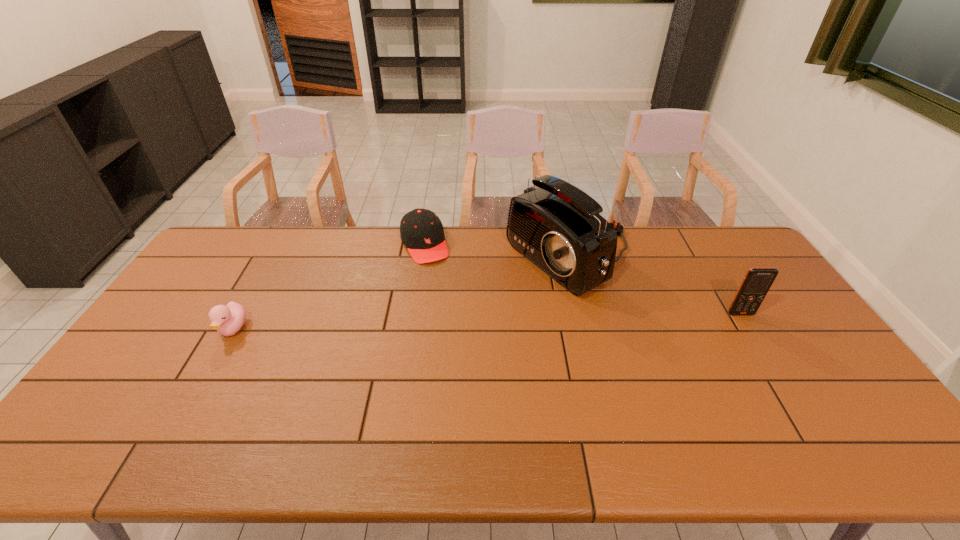
The width and height of the screenshot is (960, 540). What are the coordinates of `free space on the desktop that is between the leftmost object and the second tallest object and is positioned on the front-facing side of the cap` in the screenshot? It's located at (463, 322).

You are a GUI agent. You are given a task and a screenshot of the screen. Output one action in this format:
    pyautogui.click(x=<x>, y=<y>)
    Task: Click on the free space on the desktop that is between the leftmost object and the cellular telephone and is positioned on the front-facing side of the third object from left to right
    The image size is (960, 540).
    Given the screenshot: What is the action you would take?
    pyautogui.click(x=448, y=322)